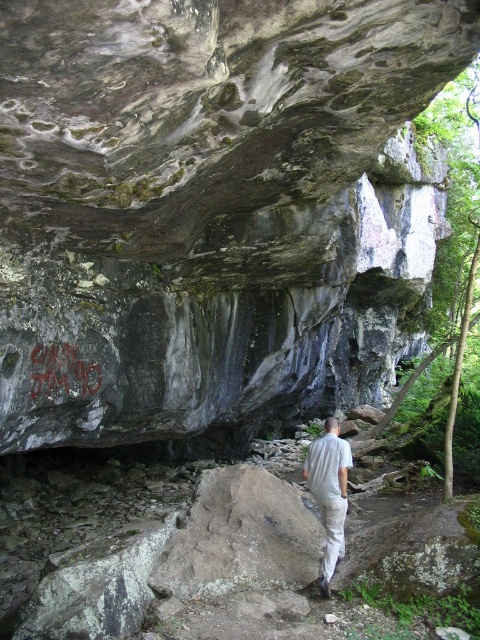
Who is positioned more to the left, dark gray textured rock at center or light gray cotton shirt at center?

light gray cotton shirt at center

Which is behind, point (126, 371) or point (340, 493)?

Point (126, 371)

At what (x,y) coordinates should I click in order to perform the action: click on dark gray textured rock at center. Please return your answer as a coordinate pair (x, y). This screenshot has height=640, width=480. Looking at the image, I should click on tap(192, 195).

Can you confirm if dark gray textured rock at center is wider than graffiti stone at center?

No, dark gray textured rock at center is not wider than graffiti stone at center.

Identify the location of dark gray textured rock at center. (192, 195).

Can you confirm if light gray cotton shirt at center is taller than graffiti stone at center?

Yes.

Between light gray cotton shirt at center and graffiti stone at center, which one has more height?

light gray cotton shirt at center

Between point (339, 445) and point (56, 384), which one is positioned behind?

The point (56, 384) is behind.

Where is `light gray cotton shirt at center`? light gray cotton shirt at center is located at coordinates (328, 492).